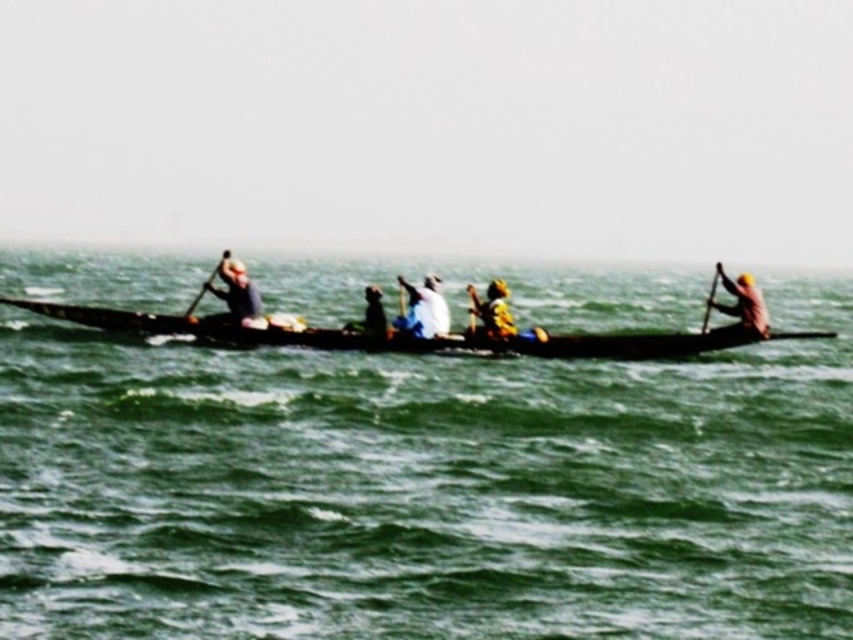
What do you see at coordinates (426, 486) in the screenshot?
I see `green water at center` at bounding box center [426, 486].

Which is above, green water at center or wooden paddle at left?

green water at center is above.

Does point (109, 396) lie in front of point (223, 260)?

Yes.

Find the location of a particular element. The height and width of the screenshot is (640, 853). green water at center is located at coordinates (426, 486).

Measure the distance between white fabric at center and camera.

They are 89.74 feet apart.

Who is more forward, (440, 300) or (718, 275)?

Point (440, 300) is more forward.

Identify the location of white fabric at center. pyautogui.click(x=422, y=308).

The image size is (853, 640). Find the location of `matte black shirt at center`. matte black shirt at center is located at coordinates (370, 314).

You are a GUI agent. You are given a task and a screenshot of the screen. Output one action in this format:
    pyautogui.click(x=<x>, y=<y>)
    Task: Click on the matte black shirt at center
    
    Given the screenshot: What is the action you would take?
    pyautogui.click(x=370, y=314)